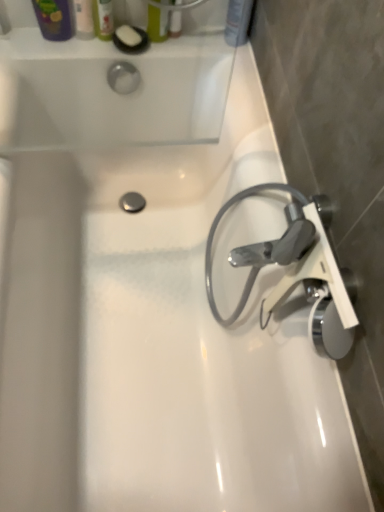
Question: From a real-world perspective, is matte plastic shampoo bottle at upper right, marked as the 1th toiletry in a right-to-left arrangement, positioned under matte plastic soap at upper left, which is the 1th toiletry from left to right, based on gravity?

Choices:
 (A) yes
 (B) no

Answer: (B)

Question: From a real-world perspective, is matte plastic shampoo bottle at upper right, marked as the 1th toiletry in a right-to-left arrangement, physically above matte plastic soap at upper left, which is the 1th toiletry from left to right?

Choices:
 (A) no
 (B) yes

Answer: (B)

Question: Considering the relative sizes of matte plastic shampoo bottle at upper right, marked as the 1th toiletry in a right-to-left arrangement, and matte plastic soap at upper left, which is the 1th toiletry from left to right, in the image provided, is matte plastic shampoo bottle at upper right, marked as the 1th toiletry in a right-to-left arrangement, wider than matte plastic soap at upper left, which is the 1th toiletry from left to right,?

Choices:
 (A) no
 (B) yes

Answer: (B)

Question: Is matte plastic shampoo bottle at upper right, which ranks as the 4th toiletry in left-to-right order, in front of matte plastic soap at upper left, arranged as the fourth toiletry when viewed from the right?

Choices:
 (A) yes
 (B) no

Answer: (A)

Question: From the image's perspective, would you say matte plastic shampoo bottle at upper right, which ranks as the 4th toiletry in left-to-right order, is shown under matte plastic soap at upper left, which is the 1th toiletry from left to right?

Choices:
 (A) yes
 (B) no

Answer: (B)

Question: From their relative heights in the image, would you say translucent plastic mouthwash at upper center is taller or shorter than satin chrome faucet at right?

Choices:
 (A) tall
 (B) short

Answer: (B)

Question: Is translucent plastic mouthwash at upper center bigger or smaller than satin chrome faucet at right?

Choices:
 (A) small
 (B) big

Answer: (A)

Question: Do you think translucent plastic mouthwash at upper center is within satin chrome faucet at right, or outside of it?

Choices:
 (A) outside
 (B) inside

Answer: (A)

Question: From the image's perspective, is translucent plastic mouthwash at upper center above or below satin chrome faucet at right?

Choices:
 (A) below
 (B) above

Answer: (B)

Question: Considering the positions of matte plastic soap at upper left, arranged as the fourth toiletry when viewed from the right, and white matte soap at upper left in the image, is matte plastic soap at upper left, arranged as the fourth toiletry when viewed from the right, wider or thinner than white matte soap at upper left?

Choices:
 (A) wide
 (B) thin

Answer: (B)

Question: From the image's perspective, is matte plastic soap at upper left, arranged as the fourth toiletry when viewed from the right, above or below white matte soap at upper left?

Choices:
 (A) above
 (B) below

Answer: (A)

Question: Considering their positions, is matte plastic soap at upper left, which is the 1th toiletry from left to right, located in front of or behind white matte soap at upper left?

Choices:
 (A) behind
 (B) front

Answer: (B)

Question: Considering the positions of matte plastic soap at upper left, arranged as the fourth toiletry when viewed from the right, and white matte soap at upper left in the image, is matte plastic soap at upper left, arranged as the fourth toiletry when viewed from the right, taller or shorter than white matte soap at upper left?

Choices:
 (A) short
 (B) tall

Answer: (B)

Question: Is satin chrome faucet at right spatially inside translucent plastic soap at upper left, acting as the 3th toiletry starting from the right, or outside of it?

Choices:
 (A) outside
 (B) inside

Answer: (A)

Question: From a real-world perspective, is satin chrome faucet at right above or below translucent plastic soap at upper left, acting as the 3th toiletry starting from the right?

Choices:
 (A) below
 (B) above

Answer: (B)